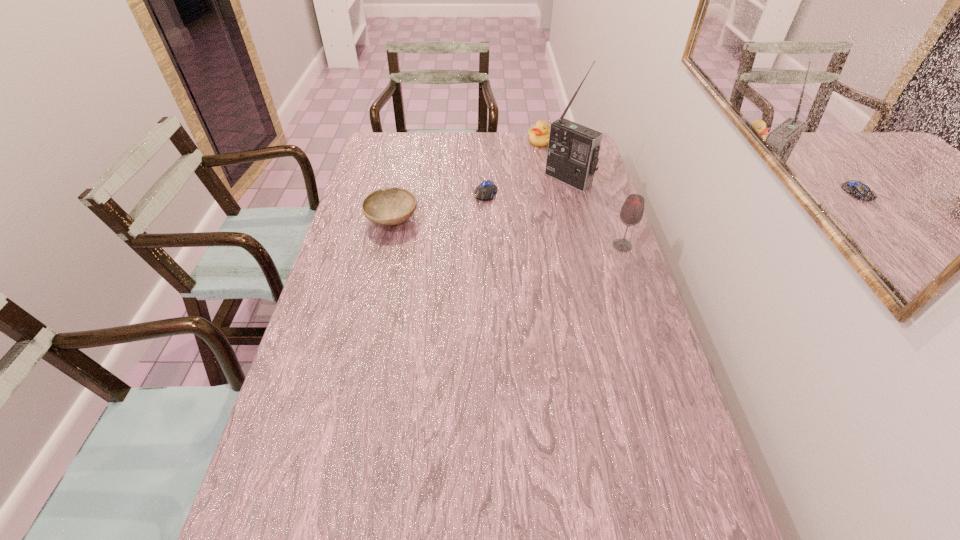
Identify the location of the second nearest object. The height and width of the screenshot is (540, 960). (392, 206).

At what (x,y) coordinates should I click in order to perform the action: click on bowl. Please return your answer as a coordinate pair (x, y). This screenshot has width=960, height=540. Looking at the image, I should click on (392, 206).

What are the coordinates of `glass drink container` in the screenshot? It's located at (631, 213).

Locate an element on the screen. the fourth shortest object is located at coordinates (631, 213).

At what (x,y) coordinates should I click in order to perform the action: click on the tallest object. Please return your answer as a coordinate pair (x, y). The image size is (960, 540). Looking at the image, I should click on (573, 149).

Where is `the third tallest object`? The width and height of the screenshot is (960, 540). the third tallest object is located at coordinates (539, 135).

This screenshot has height=540, width=960. What are the coordinates of `duckling` in the screenshot? It's located at (539, 135).

This screenshot has height=540, width=960. I want to click on computer mouse, so click(485, 191).

At what (x,y) coordinates should I click in order to perform the action: click on the second object from left to right. Please return your answer as a coordinate pair (x, y). The width and height of the screenshot is (960, 540). Looking at the image, I should click on (485, 191).

At what (x,y) coordinates should I click in order to perform the action: click on free space located on the back of the fourth tallest object. Please return your answer as a coordinate pair (x, y). This screenshot has width=960, height=540. Looking at the image, I should click on (406, 155).